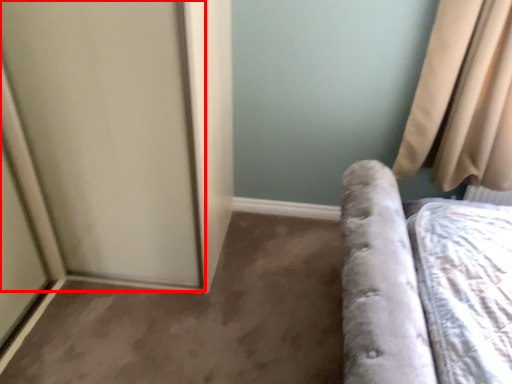
Question: From the image, what is the correct spatial relationship of screen door (annotated by the red box) in relation to curtain?

Choices:
 (A) right
 (B) left

Answer: (B)